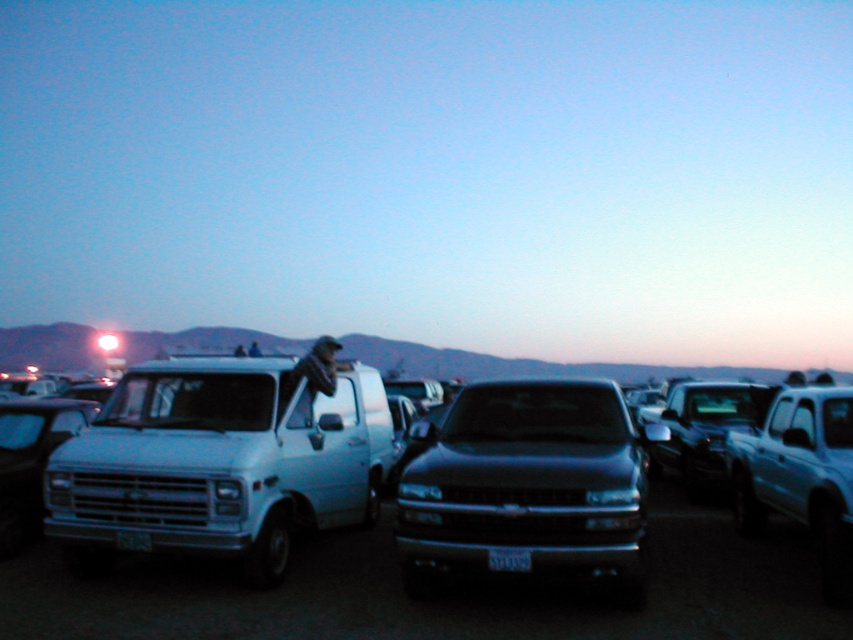
Question: Which object appears closest to the camera in this image?

Choices:
 (A) metallic silver truck at center
 (B) black glossy pickup truck at center

Answer: (B)

Question: Is white matte van at center thinner than black glossy pickup truck at center?

Choices:
 (A) no
 (B) yes

Answer: (A)

Question: Which object is the closest to the black plastic license plate at center?

Choices:
 (A) metallic silver truck at center
 (B) white matte van at center
 (C) black glossy pickup truck at center

Answer: (C)

Question: Can you confirm if metallic silver truck at center is positioned below black plastic license plate at center?

Choices:
 (A) yes
 (B) no

Answer: (A)

Question: Which of these objects is positioned farthest from the black plastic license plate at center?

Choices:
 (A) white matte van at center
 (B) black glossy pickup truck at center

Answer: (A)

Question: Can you confirm if white matte van at center is thinner than black glossy pickup truck at center?

Choices:
 (A) no
 (B) yes

Answer: (A)